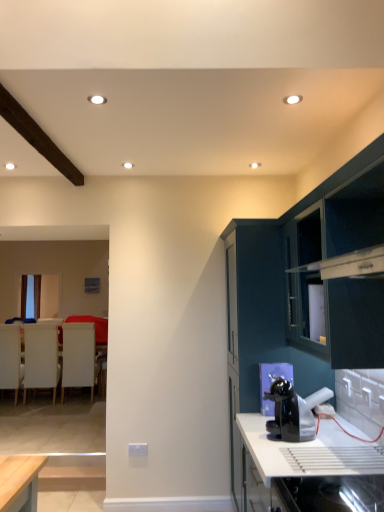
Question: Should I look upward or downward to see dark green cabinet at upper right, the second cabinetry viewed from the back?

Choices:
 (A) down
 (B) up

Answer: (A)

Question: Considering the relative sizes of black glossy coffee machine at lower center and glossy dark teal cabinet at right, marked as the second cabinetry in a front-to-back arrangement, in the image provided, is black glossy coffee machine at lower center thinner than glossy dark teal cabinet at right, marked as the second cabinetry in a front-to-back arrangement,?

Choices:
 (A) yes
 (B) no

Answer: (A)

Question: From a real-world perspective, is black glossy coffee machine at lower center located higher than glossy dark teal cabinet at right, marked as the second cabinetry in a front-to-back arrangement?

Choices:
 (A) yes
 (B) no

Answer: (B)

Question: Is black glossy coffee machine at lower center located outside glossy dark teal cabinet at right, which appears as the 1th cabinetry when viewed from the back?

Choices:
 (A) yes
 (B) no

Answer: (A)

Question: Considering the relative sizes of black glossy coffee machine at lower center and glossy dark teal cabinet at right, which appears as the 1th cabinetry when viewed from the back, in the image provided, is black glossy coffee machine at lower center taller than glossy dark teal cabinet at right, which appears as the 1th cabinetry when viewed from the back,?

Choices:
 (A) no
 (B) yes

Answer: (A)

Question: Is black glossy coffee machine at lower center not near glossy dark teal cabinet at right, marked as the second cabinetry in a front-to-back arrangement?

Choices:
 (A) no
 (B) yes

Answer: (A)

Question: Is black glossy coffee machine at lower center looking in the opposite direction of glossy dark teal cabinet at right, marked as the second cabinetry in a front-to-back arrangement?

Choices:
 (A) yes
 (B) no

Answer: (B)

Question: From the image's perspective, would you say white glossy countertop at lower right is positioned over white matte armchair at left, which is counted as the second armchair, starting from the left?

Choices:
 (A) no
 (B) yes

Answer: (B)

Question: From a real-world perspective, is white glossy countertop at lower right beneath white matte armchair at left, which is counted as the second armchair, starting from the left?

Choices:
 (A) no
 (B) yes

Answer: (B)

Question: Can you confirm if white glossy countertop at lower right is wider than white matte armchair at left, the 2th armchair positioned from the right?

Choices:
 (A) yes
 (B) no

Answer: (A)

Question: Is white glossy countertop at lower right thinner than white matte armchair at left, which is counted as the second armchair, starting from the left?

Choices:
 (A) no
 (B) yes

Answer: (A)

Question: Is white glossy countertop at lower right outside white matte armchair at left, the 2th armchair positioned from the right?

Choices:
 (A) no
 (B) yes

Answer: (B)

Question: Is the position of white glossy countertop at lower right less distant than that of white matte armchair at left, which is counted as the second armchair, starting from the left?

Choices:
 (A) yes
 (B) no

Answer: (A)

Question: Can you confirm if dark green cabinet at upper right, the second cabinetry viewed from the back, is thinner than white matte armchair at left, which is counted as the second armchair, starting from the left?

Choices:
 (A) no
 (B) yes

Answer: (B)